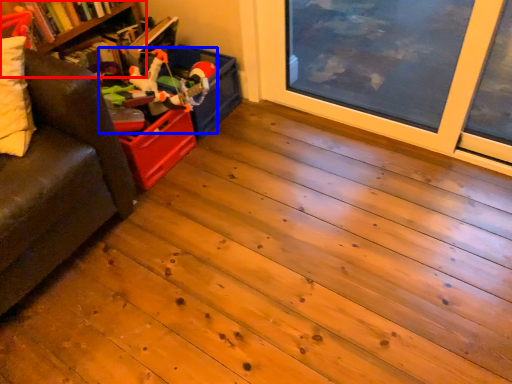
Question: Among these objects, which one is nearest to the camera, bookshelf (highlighted by a red box) or toy (highlighted by a blue box)?

Choices:
 (A) bookshelf
 (B) toy

Answer: (A)